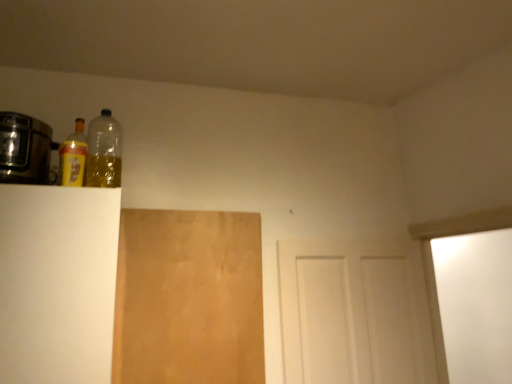
Question: In the image, is brown matte plywood at center-left on the left side or the right side of metallic silver toaster at left?

Choices:
 (A) left
 (B) right

Answer: (B)

Question: Choose the correct answer: Is brown matte plywood at center-left inside metallic silver toaster at left or outside it?

Choices:
 (A) inside
 (B) outside

Answer: (B)

Question: Based on their relative distances, which object is farther from the brown matte plywood at center-left?

Choices:
 (A) yellow matte bottle at upper left, marked as the 2th bottle in a right-to-left arrangement
 (B) metallic silver toaster at left
 (C) transparent plastic bottle at upper left, which appears as the first bottle when viewed from the right
 (D) white matte door at center
 (E) white matte cabinet at left

Answer: (B)

Question: Estimate the real-world distances between objects in this image. Which object is farther from the transparent plastic bottle at upper left, which appears as the first bottle when viewed from the right?

Choices:
 (A) brown matte plywood at center-left
 (B) white matte cabinet at left
 (C) yellow matte bottle at upper left, which is counted as the 1th bottle, starting from the left
 (D) white matte door at center
 (E) metallic silver toaster at left

Answer: (D)